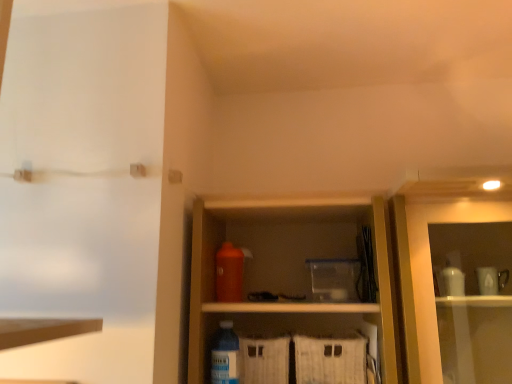
Question: From the image's perspective, would you say orange matte bottle at center, the 1th bottle when ordered from top to bottom, is shown under translucent plastic bottle at lower center, which ranks as the 1th bottle in bottom-to-top order?

Choices:
 (A) no
 (B) yes

Answer: (A)

Question: Would you say orange matte bottle at center, the 1th bottle positioned from the back, is a long distance from translucent plastic bottle at lower center, which ranks as the 1th bottle in bottom-to-top order?

Choices:
 (A) no
 (B) yes

Answer: (A)

Question: Does orange matte bottle at center, the 1th bottle when ordered from top to bottom, have a greater height compared to translucent plastic bottle at lower center, the 2th bottle from the top?

Choices:
 (A) no
 (B) yes

Answer: (A)

Question: From the image's perspective, is orange matte bottle at center, which is the 2th bottle in front-to-back order, on translucent plastic bottle at lower center, the 2th bottle viewed from the back?

Choices:
 (A) no
 (B) yes

Answer: (B)

Question: Are orange matte bottle at center, the 1th bottle when ordered from top to bottom, and translucent plastic bottle at lower center, the 2th bottle viewed from the back, making contact?

Choices:
 (A) no
 (B) yes

Answer: (A)

Question: Can you confirm if orange matte bottle at center, the second bottle positioned from the bottom, is positioned to the left of translucent plastic bottle at lower center, the 2th bottle viewed from the back?

Choices:
 (A) yes
 (B) no

Answer: (B)

Question: Is transparent plastic screen door at upper left smaller than translucent plastic bottle at lower center, the 2th bottle from the top?

Choices:
 (A) yes
 (B) no

Answer: (B)

Question: Considering the relative positions of transparent plastic screen door at upper left and translucent plastic bottle at lower center, which ranks as the 1th bottle in bottom-to-top order, in the image provided, is transparent plastic screen door at upper left behind translucent plastic bottle at lower center, which ranks as the 1th bottle in bottom-to-top order,?

Choices:
 (A) no
 (B) yes

Answer: (A)

Question: Can you confirm if transparent plastic screen door at upper left is taller than translucent plastic bottle at lower center, the 2th bottle viewed from the back?

Choices:
 (A) no
 (B) yes

Answer: (B)

Question: Could you tell me if transparent plastic screen door at upper left is turned towards translucent plastic bottle at lower center, the first bottle from the front?

Choices:
 (A) yes
 (B) no

Answer: (B)

Question: From the image's perspective, would you say transparent plastic screen door at upper left is positioned over translucent plastic bottle at lower center, the first bottle from the front?

Choices:
 (A) yes
 (B) no

Answer: (A)

Question: Does transparent plastic screen door at upper left have a greater width compared to translucent plastic bottle at lower center, the 2th bottle viewed from the back?

Choices:
 (A) no
 (B) yes

Answer: (B)

Question: Can we say orange matte bottle at center, the 1th bottle positioned from the back, lies outside transparent plastic screen door at upper left?

Choices:
 (A) yes
 (B) no

Answer: (A)